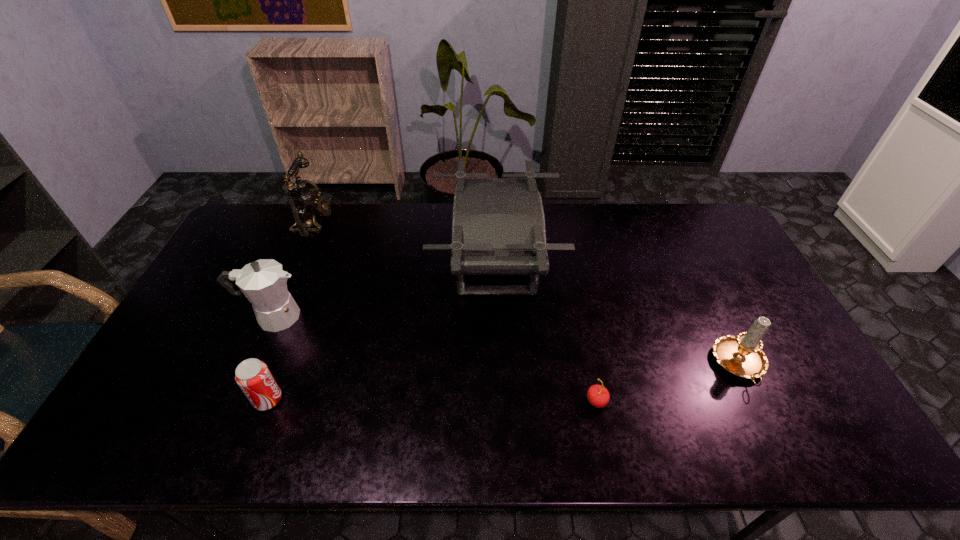
This screenshot has height=540, width=960. In order to click on vacant space that is in between the drone and the telephone in this screenshot , I will do [404, 242].

I want to click on vacant region between the shortest object and the telephone, so click(455, 312).

Locate an element on the screen. This screenshot has width=960, height=540. free space between the candle and the soda can is located at coordinates (504, 382).

Identify which object is located as the third nearest to the candle. Please provide its 2D coordinates. Your answer should be formatted as a tuple, i.e. [(x, y)], where the tuple contains the x and y coordinates of a point satisfying the conditions above.

[(253, 377)]

At what (x,y) coordinates should I click in order to perform the action: click on object that is the second closest to the third object from right to left. Please return your answer as a coordinate pair (x, y). The image size is (960, 540). Looking at the image, I should click on (263, 282).

This screenshot has height=540, width=960. Identify the location of vacant area that satisfies the following two spatial constraints: 1. on the back side of the shortest object; 2. on the rotary dial of the telephone. (560, 222).

In order to click on free location that satisfies the following two spatial constraints: 1. on the rotary dial of the fifth object from left to right; 2. on the right side of the telephone in this screenshot , I will do `click(236, 401)`.

The image size is (960, 540). Find the location of `free space in the image that satisfies the following two spatial constraints: 1. with a camera mounted on the underside of the fifth object from left to right; 2. on the right side of the drone`. free space in the image that satisfies the following two spatial constraints: 1. with a camera mounted on the underside of the fifth object from left to right; 2. on the right side of the drone is located at coordinates (500, 401).

I want to click on vacant space that satisfies the following two spatial constraints: 1. with a camera mounted on the underside of the third object from right to left; 2. on the left side of the second object from right to left, so click(x=500, y=401).

Locate an element on the screen. free space in the image that satisfies the following two spatial constraints: 1. on the back side of the cherry; 2. at the spout of the coffeepot is located at coordinates (579, 316).